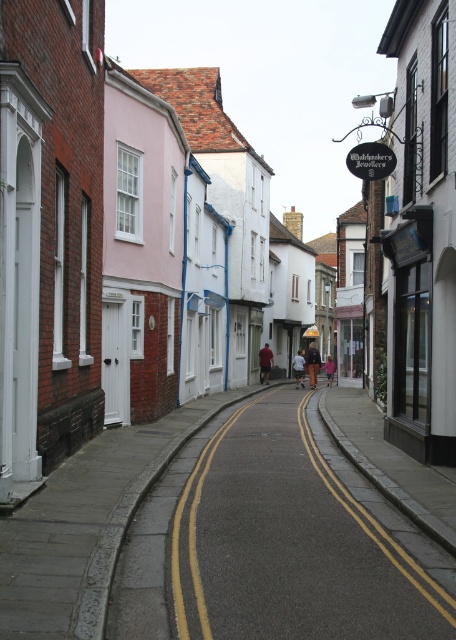
You are a tailor trying to determine if a mannequin can display both the dark brown leather jacket at center and the dark blue jeans at center side by side without overlapping. The mannequin has a display area 1.2 meters wide. Can both items fit?

The dark brown leather jacket at center is wider than the dark blue jeans at center. Since the total width of both items combined may exceed the mannequin display area of 1.2 meters, it depends on their exact measurements. However, the jacket being wider suggests that together they might not fit within the 1.2 meter limit.

You are standing at the beginning of the street and want to walk towards the point that is closer to you. Which point should you head towards, point (134,573) or point (328,385)?

Point (134,573) is closer to the viewer, so you should head towards point (134,573).

You are a fashion designer observing a person standing in the middle of the quaint street. You notice the dark brown leather jacket at center and the dark blue jeans at center. Which clothing item is positioned higher on the person?

The dark brown leather jacket at center is above the dark blue jeans at center, so the dark brown leather jacket at center is positioned higher on the person.